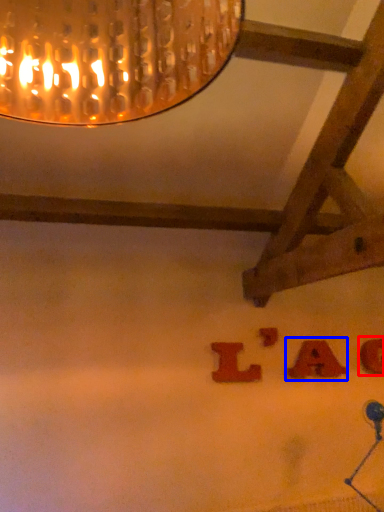
Question: Which of the following is the closest to the observer, alphabet (highlighted by a red box) or alphabet (highlighted by a blue box)?

Choices:
 (A) alphabet
 (B) alphabet

Answer: (B)